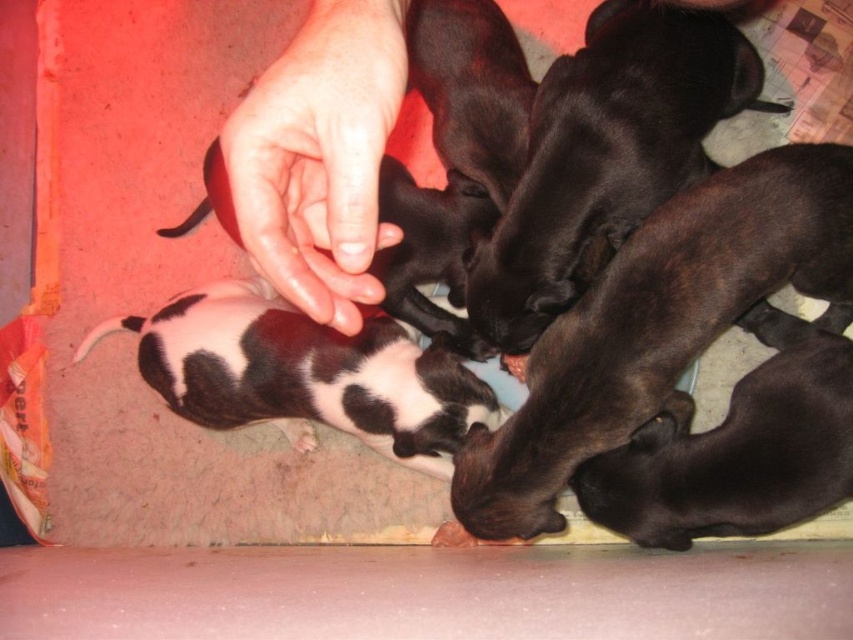
Which is below, pink flesh at center or spotted fur puppy at center?

spotted fur puppy at center is below.

Measure the distance between point (x=247, y=109) and camera.

The distance of point (x=247, y=109) from camera is 20.36 inches.

I want to click on pink flesh at center, so click(x=320, y=157).

Can you confirm if black matte dog at center is wider than pink flesh at center?

Correct, the width of black matte dog at center exceeds that of pink flesh at center.

Is point (563, 476) behind point (354, 92)?

Yes, it is behind point (354, 92).

In order to click on black matte dog at center in this screenshot , I will do `click(659, 323)`.

Between point (228, 353) and point (775, 520), which one is positioned behind?

Positioned behind is point (228, 353).

The width and height of the screenshot is (853, 640). What do you see at coordinates (305, 372) in the screenshot?
I see `spotted fur puppy at center` at bounding box center [305, 372].

Where is `spotted fur puppy at center`? This screenshot has height=640, width=853. spotted fur puppy at center is located at coordinates (305, 372).